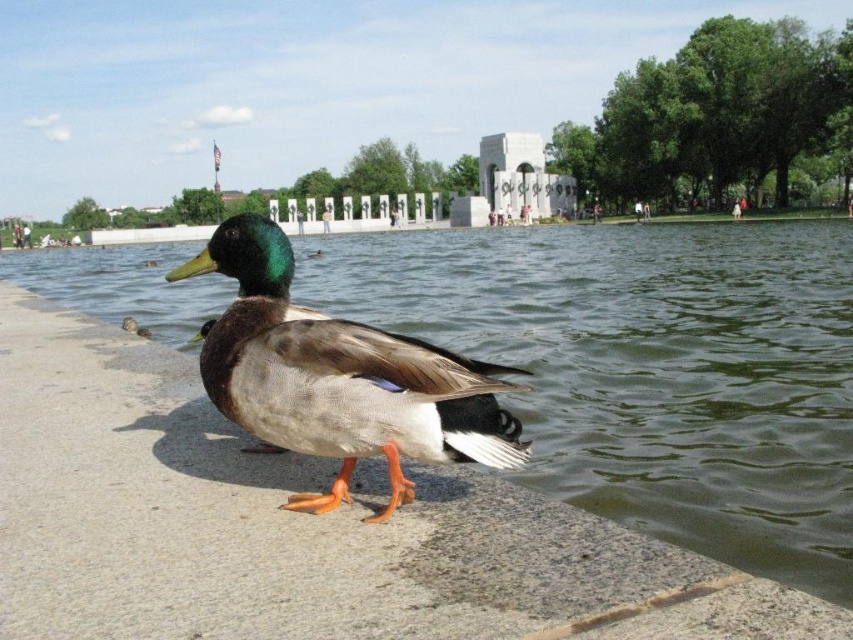
What are the coordinates of `greenish water at lower left` in the screenshot? It's located at (648, 369).

Is greenish water at lower left thinner than matte brown duck at center?

No, greenish water at lower left is not thinner than matte brown duck at center.

Identify the location of greenish water at lower left. The height and width of the screenshot is (640, 853). (648, 369).

Based on the photo, can you confirm if matte brown duck at center is thinner than green matte duck at center?

Incorrect, matte brown duck at center's width is not less than green matte duck at center's.

Is matte brown duck at center shorter than green matte duck at center?

Incorrect, matte brown duck at center's height does not fall short of green matte duck at center's.

In order to click on matte brown duck at center in this screenshot , I will do `click(339, 376)`.

Looking at this image, who is lower down, greenish water at lower left or green matte duck at center?

green matte duck at center

Does greenish water at lower left have a greater width compared to green matte duck at center?

Yes, greenish water at lower left is wider than green matte duck at center.

At what (x,y) coordinates should I click in order to perform the action: click on greenish water at lower left. Please return your answer as a coordinate pair (x, y). The width and height of the screenshot is (853, 640). Looking at the image, I should click on (648, 369).